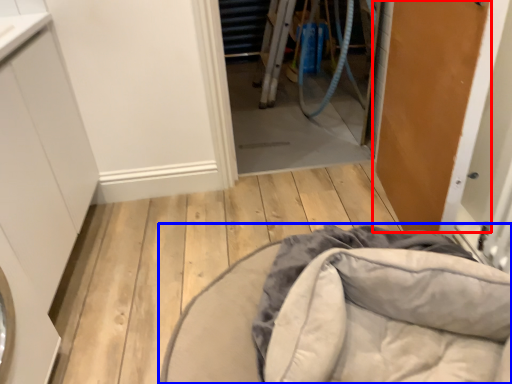
Question: Which object is closer to the camera taking this photo, door (highlighted by a red box) or furniture (highlighted by a blue box)?

Choices:
 (A) door
 (B) furniture

Answer: (A)